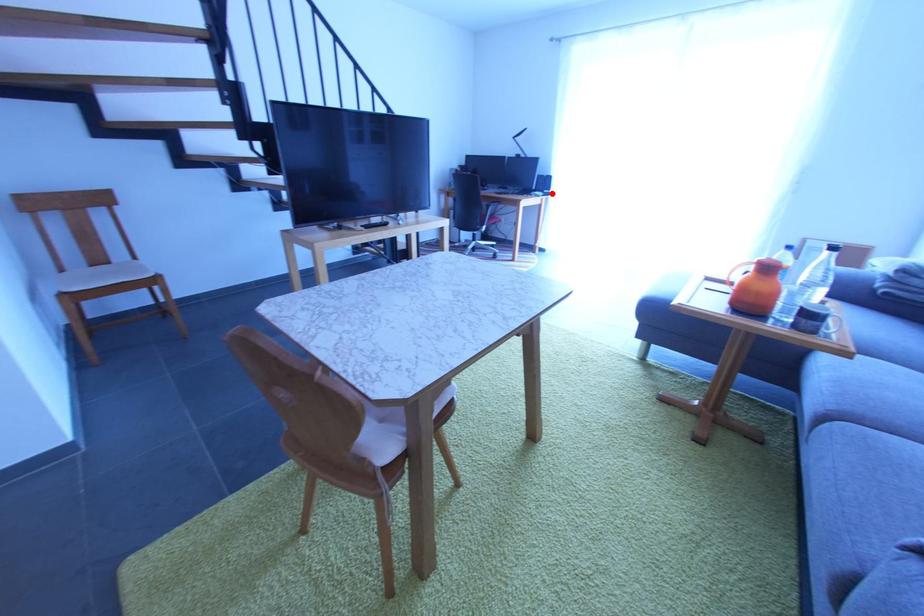
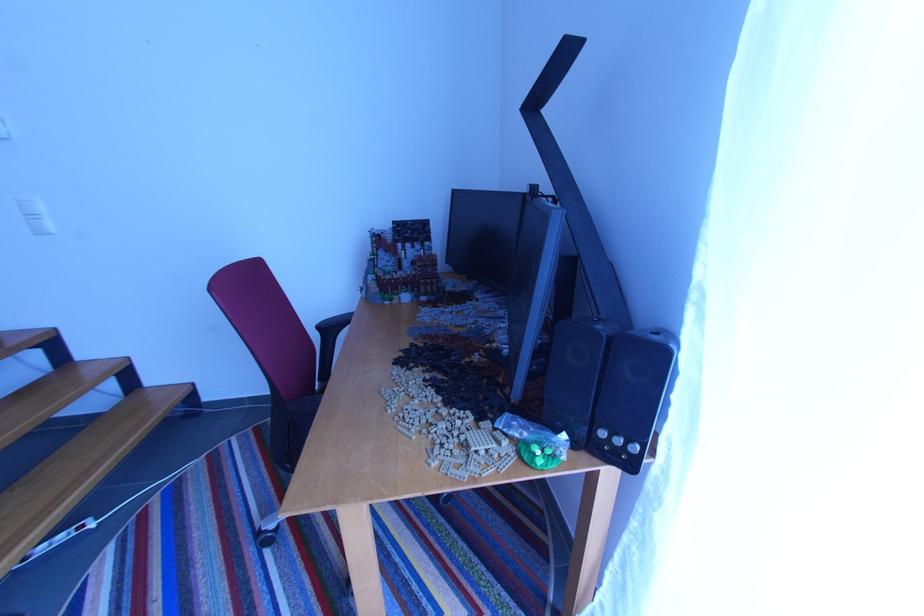
Question: A red point is marked in image1. In image2, is the corresponding 3D point closer to the camera or farther? Reply with the corresponding letter.

Choices:
 (A) The corresponding 3D point is closer.
 (B) The corresponding 3D point is farther.

Answer: (B)